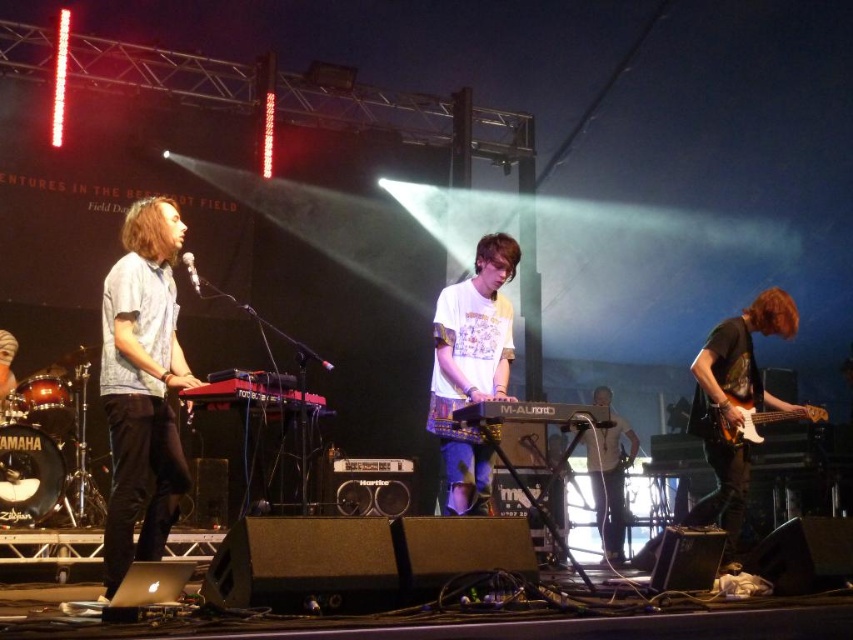
Question: Which point is farther from the camera taking this photo?

Choices:
 (A) (621, 522)
 (B) (799, 413)

Answer: (A)

Question: Which object appears closest to the camera in this image?

Choices:
 (A) white glossy electric guitar at right
 (B) white cotton t-shirt at center
 (C) white matte shirt at center

Answer: (B)

Question: Is matte light blue shirt at left wider than white matte shirt at center?

Choices:
 (A) yes
 (B) no

Answer: (B)

Question: Is matte light blue shirt at left positioned in front of white glossy electric guitar at right?

Choices:
 (A) no
 (B) yes

Answer: (B)

Question: Which of these objects is positioned farthest from the white matte shirt at center?

Choices:
 (A) white glossy electric guitar at right
 (B) matte light blue shirt at left
 (C) dark green textured t-shirt at right
 (D) white cotton t-shirt at center

Answer: (B)

Question: Considering the relative positions of dark green textured t-shirt at right and white glossy electric guitar at right in the image provided, where is dark green textured t-shirt at right located with respect to white glossy electric guitar at right?

Choices:
 (A) above
 (B) below

Answer: (A)